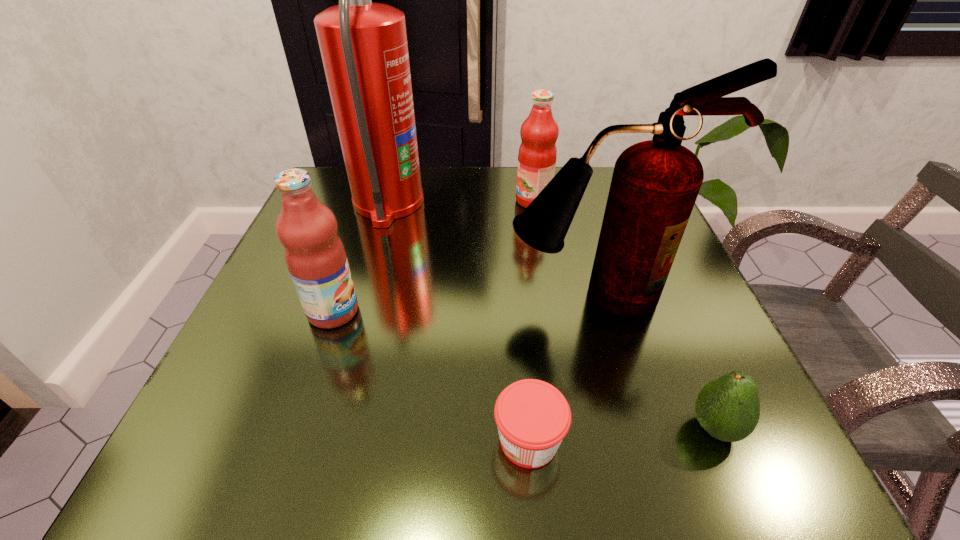
In order to click on vacant region between the avocado and the left fire extinguisher in this screenshot , I will do `click(551, 316)`.

Locate an element on the screen. Image resolution: width=960 pixels, height=540 pixels. free spot between the left fruit juice and the second tallest object is located at coordinates (466, 303).

I want to click on free space between the fifth tallest object and the shortest object, so click(x=621, y=434).

Locate an element on the screen. This screenshot has height=540, width=960. object that is the fifth closest to the nearer fruit juice is located at coordinates (728, 408).

Locate which object ranks in proximity to the shortest object. Please provide its 2D coordinates. Your answer should be formatted as a tuple, i.e. [(x, y)], where the tuple contains the x and y coordinates of a point satisfying the conditions above.

[(655, 183)]

Find the location of `free spot that satisfies the following two spatial constraints: 1. at the nozzle of the fifth shortest object; 2. on the left side of the second shortest object`. free spot that satisfies the following two spatial constraints: 1. at the nozzle of the fifth shortest object; 2. on the left side of the second shortest object is located at coordinates (635, 428).

Find the location of a particular element. This screenshot has width=960, height=540. free space that satisfies the following two spatial constraints: 1. at the nozzle of the right fire extinguisher; 2. on the left side of the fifth tallest object is located at coordinates (635, 428).

Locate an element on the screen. blank space that satisfies the following two spatial constraints: 1. on the front label of the nearer fruit juice; 2. on the right side of the avocado is located at coordinates (294, 428).

The width and height of the screenshot is (960, 540). Find the location of `free space that satisfies the following two spatial constraints: 1. on the front label of the farther fruit juice; 2. on the back side of the fifth tallest object`. free space that satisfies the following two spatial constraints: 1. on the front label of the farther fruit juice; 2. on the back side of the fifth tallest object is located at coordinates (571, 428).

You are a GUI agent. You are given a task and a screenshot of the screen. Output one action in this format:
    pyautogui.click(x=<x>, y=<y>)
    Task: Click on the free point that satisfies the following two spatial constraints: 1. at the nozzle of the shorter fire extinguisher; 2. on the front label of the left fruit juice
    This screenshot has height=540, width=960.
    Given the screenshot: What is the action you would take?
    pyautogui.click(x=602, y=312)